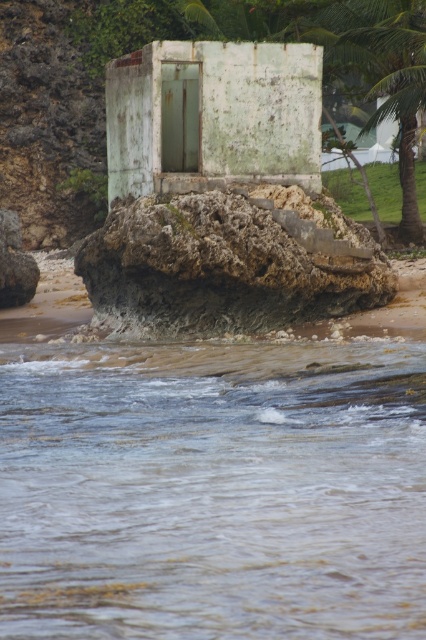
Can you confirm if muddy water at lower center is bigger than green leafy palm tree at upper right?

No.

Is muddy water at lower center shorter than green leafy palm tree at upper right?

Correct, muddy water at lower center is not as tall as green leafy palm tree at upper right.

Where is `muddy water at lower center`? The width and height of the screenshot is (426, 640). muddy water at lower center is located at coordinates (210, 492).

Between point (325, 260) and point (333, 28), which one is positioned in front?

Point (325, 260) is more forward.

Who is shorter, rusty concrete rock at center or green leafy palm tree at upper right?

Standing shorter between the two is rusty concrete rock at center.

The width and height of the screenshot is (426, 640). In order to click on rusty concrete rock at center in this screenshot , I will do `click(227, 262)`.

Where is `rusty concrete rock at center`? This screenshot has width=426, height=640. rusty concrete rock at center is located at coordinates (227, 262).

Which is behind, point (198, 44) or point (409, 148)?

The point (409, 148) is more distant.

Does rusty metal hut at center appear under green leafy palm tree at upper right?

Indeed, rusty metal hut at center is positioned under green leafy palm tree at upper right.

This screenshot has height=640, width=426. I want to click on rusty metal hut at center, so click(213, 115).